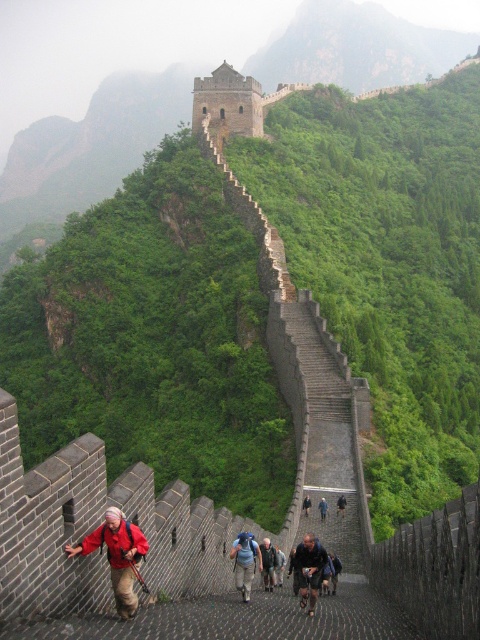
You are a hiker standing on the Great Wall of China and want to place your dark gray fabric backpack at center on a nearby flat surface. The nearest flat surface is 50 meters away from you. Can you safely place your backpack there without it rolling downhill?

The dark gray fabric backpack at center is 52.36 meters from viewer, which is farther than the nearest flat surface at 50 meters. Therefore, you cannot safely place your backpack there as it would be beyond the designated area.